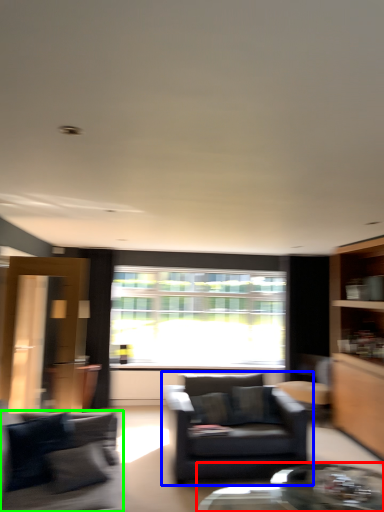
Question: Considering the real-world distances, which object is closest to coffee table (highlighted by a red box)? chair (highlighted by a blue box) or studio couch (highlighted by a green box).

Choices:
 (A) chair
 (B) studio couch

Answer: (A)